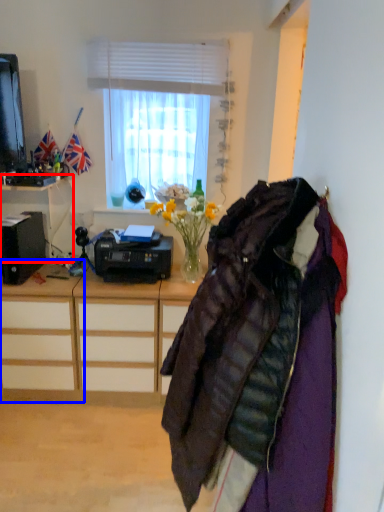
Question: Which object appears farthest to the camera in this image, desk (highlighted by a red box) or desk (highlighted by a blue box)?

Choices:
 (A) desk
 (B) desk

Answer: (B)